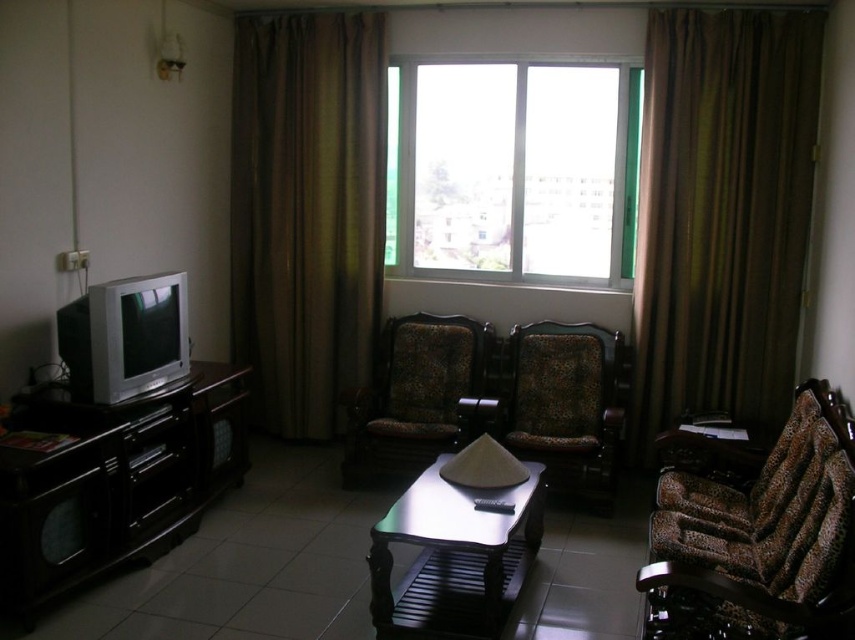
Question: Which object appears farthest from the camera in this image?

Choices:
 (A) transparent glass window at center
 (B) brown fabric curtain at right
 (C) brown textured curtain at center
 (D) patterned fabric armchair at center

Answer: (C)

Question: In this image, where is brown fabric curtain at right located relative to brown textured curtain at center?

Choices:
 (A) right
 (B) left

Answer: (A)

Question: Which of the following is the farthest from the observer?

Choices:
 (A) (457, 353)
 (B) (559, 173)
 (C) (617, 340)
 (D) (450, 456)

Answer: (B)

Question: From the image, what is the correct spatial relationship of brown textured curtain at center in relation to leopard print fabric armchair at center?

Choices:
 (A) right
 (B) left

Answer: (B)

Question: Can you confirm if brown fabric curtain at right is smaller than metallic silver table at center?

Choices:
 (A) yes
 (B) no

Answer: (B)

Question: Estimate the real-world distances between objects in this image. Which object is farther from the leopard print fabric armchair at center?

Choices:
 (A) brown textured curtain at center
 (B) brown fabric curtain at right
 (C) brown leopard print armchair at lower right
 (D) patterned fabric armchair at center

Answer: (A)